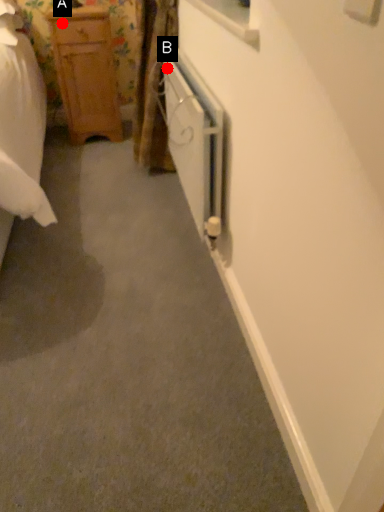
Question: Two points are circled on the image, labeled by A and B beside each circle. Which of the following is the closest to the observer?

Choices:
 (A) A is closer
 (B) B is closer

Answer: (B)